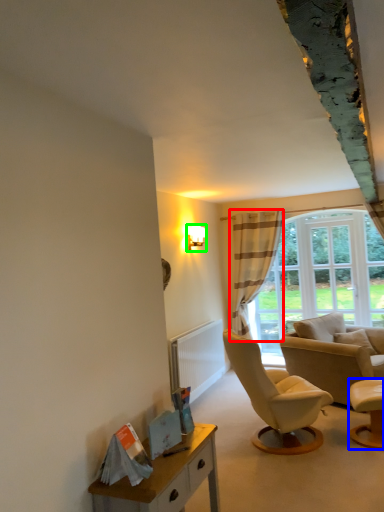
Question: Which object is the closest to the curtain (highlighted by a red box)? Choose among these: chair (highlighted by a blue box) or lamp (highlighted by a green box).

Choices:
 (A) chair
 (B) lamp

Answer: (B)